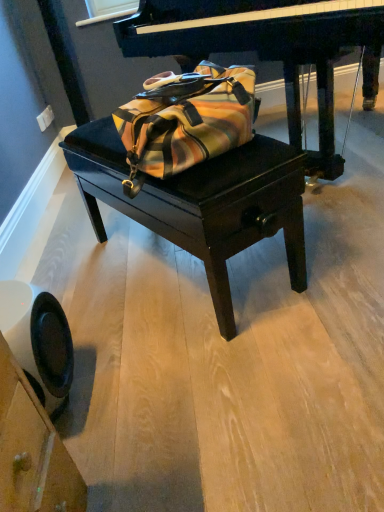
Question: Can you confirm if velvet black table at center is thinner than polished dark wood piano at center?

Choices:
 (A) no
 (B) yes

Answer: (B)

Question: Does velvet black table at center lie in front of polished dark wood piano at center?

Choices:
 (A) yes
 (B) no

Answer: (A)

Question: From the image's perspective, is velvet black table at center under polished dark wood piano at center?

Choices:
 (A) no
 (B) yes

Answer: (B)

Question: From the image's perspective, is velvet black table at center on top of polished dark wood piano at center?

Choices:
 (A) yes
 (B) no

Answer: (B)

Question: Is velvet black table at center further to the viewer compared to polished dark wood piano at center?

Choices:
 (A) no
 (B) yes

Answer: (A)

Question: Is velvet black table at center at the left side of polished dark wood piano at center?

Choices:
 (A) no
 (B) yes

Answer: (B)

Question: Considering the relative sizes of velvet black table at center and black plastic swivel chair at lower left in the image provided, is velvet black table at center wider than black plastic swivel chair at lower left?

Choices:
 (A) yes
 (B) no

Answer: (A)

Question: Would you say velvet black table at center is a long distance from black plastic swivel chair at lower left?

Choices:
 (A) yes
 (B) no

Answer: (B)

Question: From the image's perspective, is velvet black table at center on top of black plastic swivel chair at lower left?

Choices:
 (A) yes
 (B) no

Answer: (A)

Question: Does velvet black table at center lie behind black plastic swivel chair at lower left?

Choices:
 (A) yes
 (B) no

Answer: (A)

Question: Considering the relative positions of velvet black table at center and black plastic swivel chair at lower left in the image provided, is velvet black table at center to the right of black plastic swivel chair at lower left from the viewer's perspective?

Choices:
 (A) yes
 (B) no

Answer: (A)

Question: Is velvet black table at center thinner than black plastic swivel chair at lower left?

Choices:
 (A) yes
 (B) no

Answer: (B)

Question: Are polished dark wood piano at center and black plastic swivel chair at lower left far apart?

Choices:
 (A) yes
 (B) no

Answer: (A)